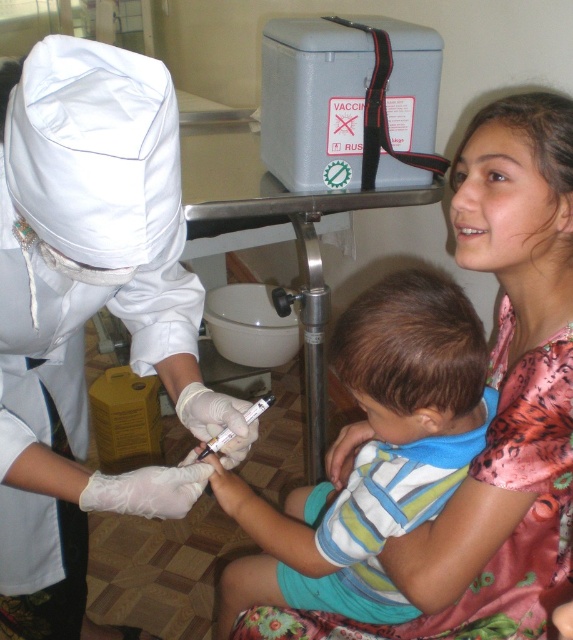
Question: Considering the real-world distances, which object is farthest from the white plastic syringe at center?

Choices:
 (A) white matte uniform at center
 (B) striped cotton shirt at center

Answer: (A)

Question: Is striped cotton shirt at center smaller than white plastic syringe at center?

Choices:
 (A) yes
 (B) no

Answer: (B)

Question: In this image, where is white matte uniform at center located relative to white plastic syringe at center?

Choices:
 (A) left
 (B) right

Answer: (A)

Question: Which of the following is the closest to the observer?

Choices:
 (A) white plastic syringe at center
 (B) striped cotton shirt at center
 (C) white matte uniform at center

Answer: (C)

Question: Which point is closer to the camera taking this photo?

Choices:
 (A) (258, 412)
 (B) (421, 438)
 (C) (163, 204)

Answer: (C)

Question: Does white matte uniform at center appear under striped cotton shirt at center?

Choices:
 (A) no
 (B) yes

Answer: (A)